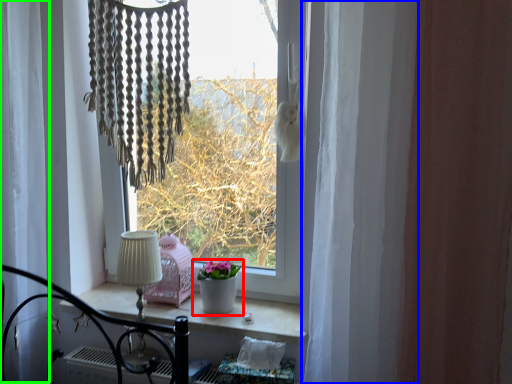
Question: Which object is positioned farthest from houseplant (highlighted by a red box)? Select from curtain (highlighted by a blue box) and curtain (highlighted by a green box).

Choices:
 (A) curtain
 (B) curtain

Answer: (B)